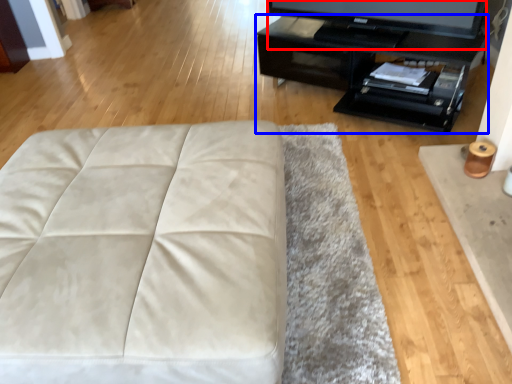
Question: Among these objects, which one is nearest to the camera, television (highlighted by a red box) or table (highlighted by a blue box)?

Choices:
 (A) television
 (B) table

Answer: (B)